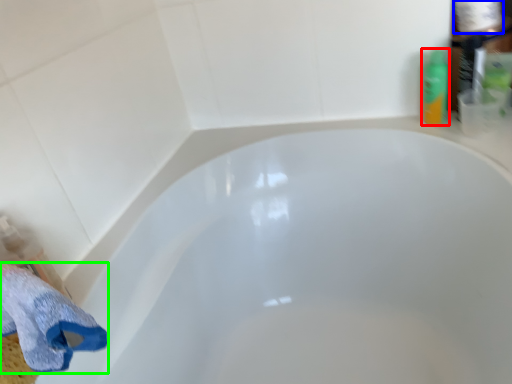
Question: Which object is positioned closest to toiletry (highlighted by a red box)? Select from toilet paper (highlighted by a blue box) and bath towel (highlighted by a green box).

Choices:
 (A) toilet paper
 (B) bath towel

Answer: (A)